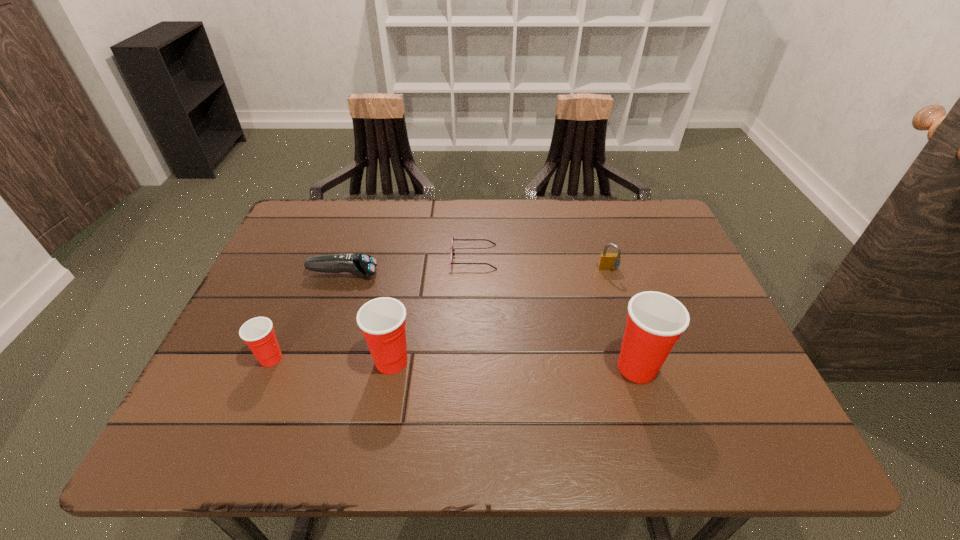
What are the coordinates of `blank region between the rightmost Dixie cup and the shortest Dixie cup` in the screenshot? It's located at [x=454, y=363].

The image size is (960, 540). Find the location of `free spot between the fifth shortest object and the padlock`. free spot between the fifth shortest object and the padlock is located at coordinates (500, 316).

Find the location of a particular element. The width and height of the screenshot is (960, 540). vacant point located between the fourth object from left to right and the second Dixie cup from right to left is located at coordinates (432, 309).

Identify which object is located as the third nearest to the leftmost Dixie cup. Please provide its 2D coordinates. Your answer should be formatted as a tuple, i.e. [(x, y)], where the tuple contains the x and y coordinates of a point satisfying the conditions above.

[(452, 250)]

Find the location of a particular element. object that stands as the second closest to the shortest Dixie cup is located at coordinates (362, 265).

Identify which Dixie cup is the second closest to the sunglasses. Please provide its 2D coordinates. Your answer should be formatted as a tuple, i.e. [(x, y)], where the tuple contains the x and y coordinates of a point satisfying the conditions above.

[(655, 321)]

At what (x,y) coordinates should I click in order to perform the action: click on Dixie cup that is the third nearest to the shortest object. Please return your answer as a coordinate pair (x, y). Looking at the image, I should click on (258, 333).

The image size is (960, 540). Find the location of `vacant space that satisfies the following two spatial constraints: 1. on the bridge of the third object from right to left; 2. on the right side of the rightmost Dixie cup`. vacant space that satisfies the following two spatial constraints: 1. on the bridge of the third object from right to left; 2. on the right side of the rightmost Dixie cup is located at coordinates (471, 367).

Locate an element on the screen. free location that satisfies the following two spatial constraints: 1. on the front side of the rightmost Dixie cup; 2. on the left side of the leftmost Dixie cup is located at coordinates (267, 367).

Locate an element on the screen. vacant space that satisfies the following two spatial constraints: 1. on the head of the fifth tallest object; 2. on the back side of the second shortest Dixie cup is located at coordinates pos(314,361).